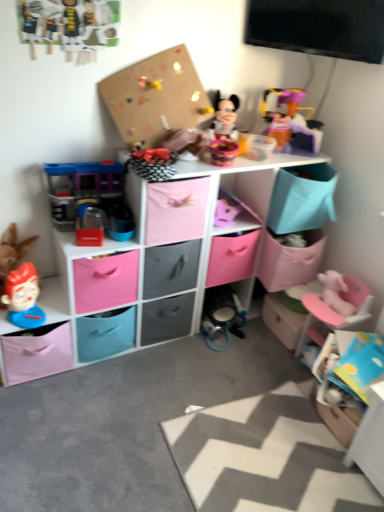
Find the location of `vacant point to the right of pink fabric storage box at left, arranged as the 1th storage box when viewed from the left`. vacant point to the right of pink fabric storage box at left, arranged as the 1th storage box when viewed from the left is located at coordinates (96, 390).